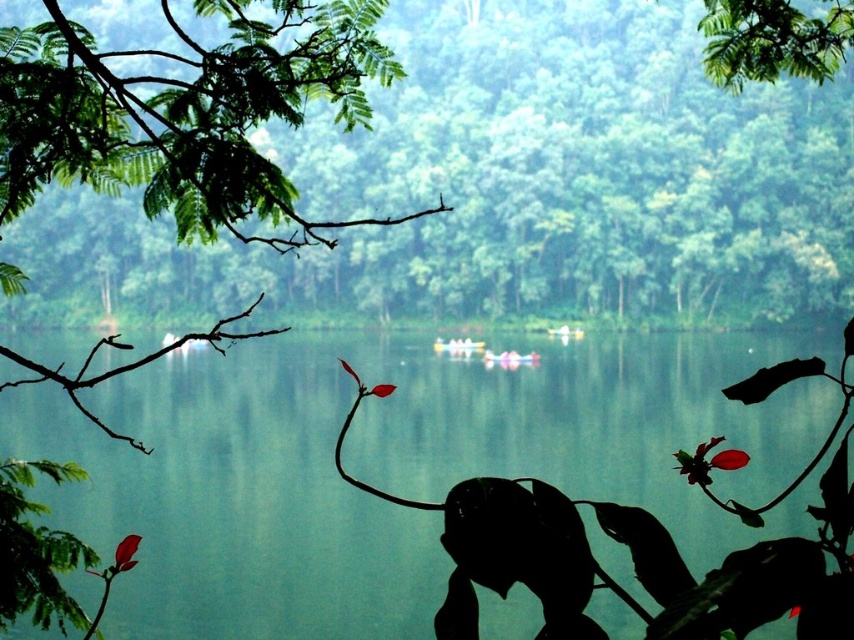
You are standing in the serene natural scene described. You want to reach the green leafy branch at upper left to examine its red flowers. Considering the distance between you and the branch, is it possible to touch it without moving from your current position?

The green leafy branch at upper left is 1.50 meters away from the viewer. Since this distance is within arm reach for most people, you can likely touch the green leafy branch at upper left without moving from your current position.

You are an observer standing on the shore looking at the yellow matte boat at center and the green smooth water at center. Which object is closer to you?

The yellow matte boat at center is closer to you than the green smooth water at center because it is positioned above it.

You are a photographer standing in the foreground of this scene, aiming to capture the yellow matte boat at center in your shot. However, you notice that the green smooth water at center is blocking your view. Can you adjust your position to ensure the boat is fully visible without the water obscuring it?

The green smooth water at center is in front of the yellow matte boat at center, so moving your position to a higher elevation or shifting sideways might allow you to see around or over the water to capture the boat without obstruction.